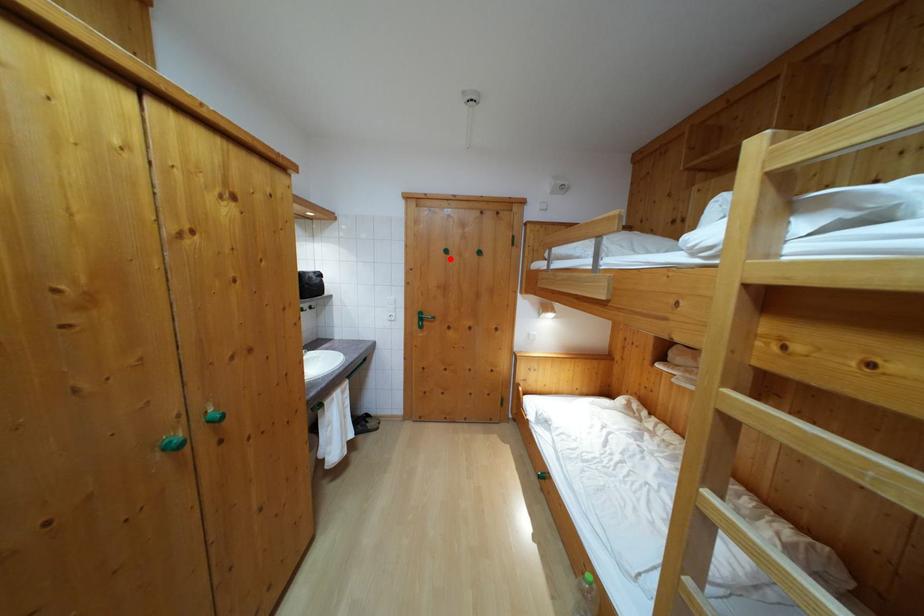
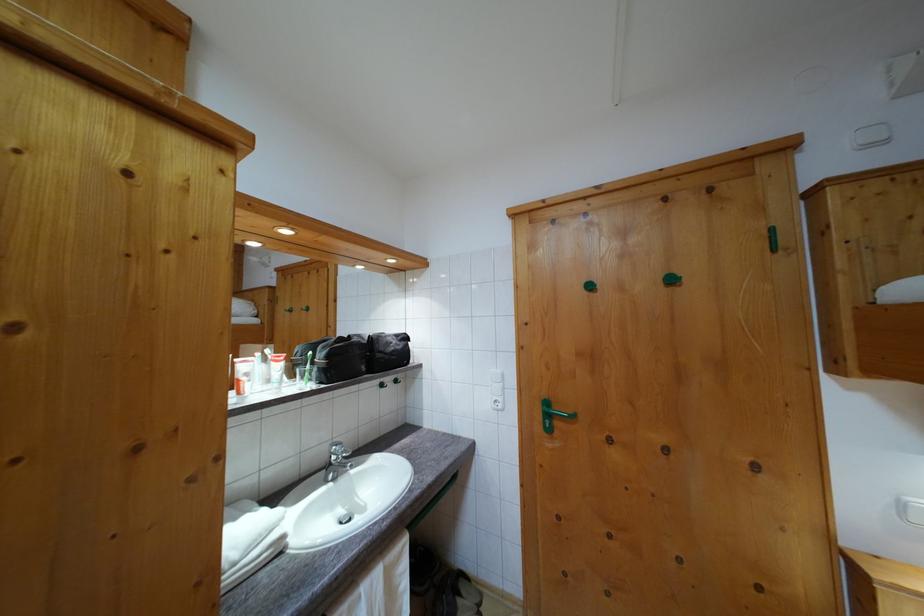
Where in the second image is the point corresponding to the highlighted location from the first image?

(593, 294)